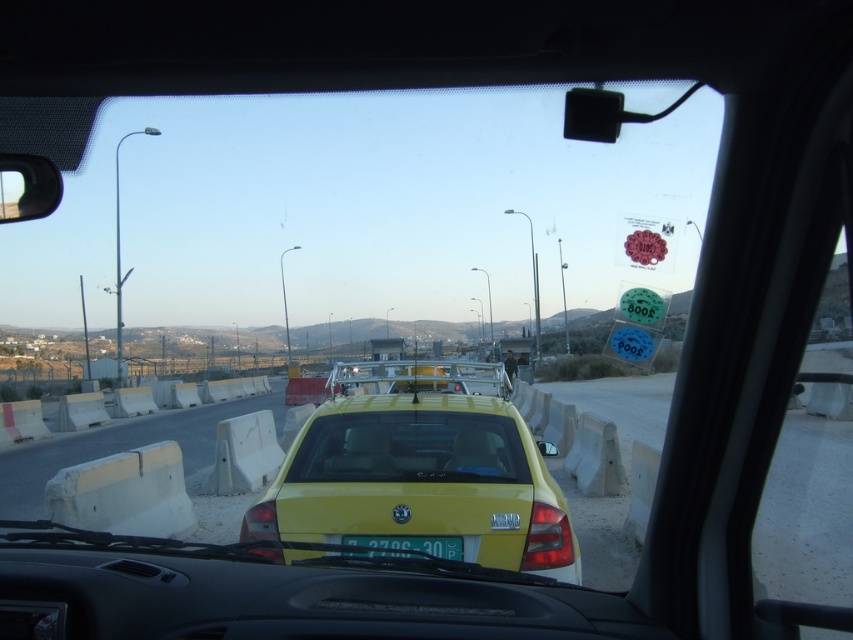
Question: Does yellow matte taxi at center appear on the right side of transparent glass windshield at center?

Choices:
 (A) yes
 (B) no

Answer: (A)

Question: From the image, what is the correct spatial relationship of yellow matte taxi at center in relation to transparent glass windshield at center?

Choices:
 (A) below
 (B) above

Answer: (B)

Question: Based on their relative distances, which object is nearer to the yellow matte taxi at center?

Choices:
 (A) yellow plastic license plate at center
 (B) transparent glass windshield at center

Answer: (B)

Question: Which point is closer to the camera?

Choices:
 (A) transparent glass windshield at center
 (B) yellow matte taxi at center
 (C) yellow plastic license plate at center

Answer: (C)

Question: Which point is farther from the camera taking this photo?

Choices:
 (A) (450, 547)
 (B) (465, 492)
 (C) (468, 451)

Answer: (C)

Question: Is transparent glass windshield at center behind yellow plastic license plate at center?

Choices:
 (A) no
 (B) yes

Answer: (B)